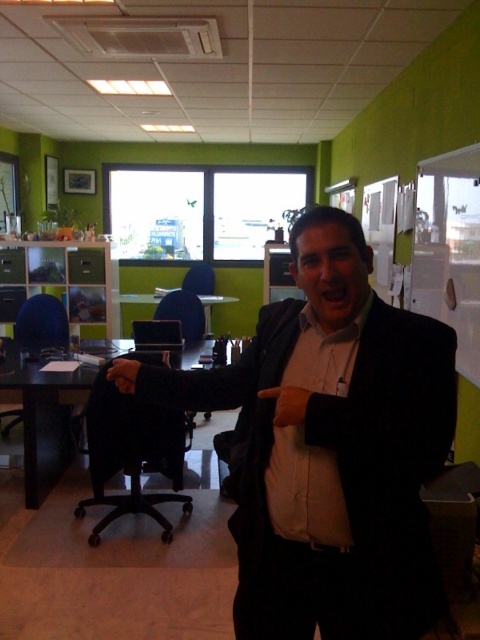
You are an office worker who needs to sit down to work. There is a black plastic swivel chair at center and a leather glove at center. Which object should you choose to sit on?

You should choose the black plastic swivel chair at center because it is wider than the leather glove at center, making it suitable for sitting.

You are an office worker who needs to store both the black matte suit at center and the leather glove at center in a narrow drawer. Based on their sizes, which item should you place first to ensure both fit?

The black matte suit at center is wider than the leather glove at center. Therefore, you should place the black matte suit at center first in the narrow drawer to accommodate its larger size before adding the smaller leather glove at center.

You are an office worker who needs to locate your black matte suit at center and leather glove at center. According to the scene, which object is positioned to the right of the other?

The black matte suit at center is to the right of the leather glove at center.